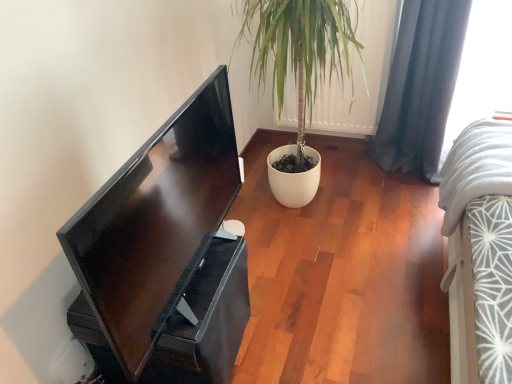
Describe the element at coordinates (482, 69) in the screenshot. The width and height of the screenshot is (512, 384). I see `white fabric at upper right` at that location.

The width and height of the screenshot is (512, 384). Find the location of `matte black monitor at left`. matte black monitor at left is located at coordinates (165, 253).

Is there a large distance between dark blue fabric curtain at right and white fabric at upper right?

They are positioned close to each other.

Considering the relative sizes of dark blue fabric curtain at right and white fabric at upper right in the image provided, is dark blue fabric curtain at right shorter than white fabric at upper right?

In fact, dark blue fabric curtain at right may be taller than white fabric at upper right.

Would you say dark blue fabric curtain at right is to the left or to the right of white fabric at upper right in the picture?

dark blue fabric curtain at right is positioned on white fabric at upper right's left side.

Is dark blue fabric curtain at right closer to the viewer compared to white fabric at upper right?

That is False.

Looking at the image, does white fabric at upper right seem bigger or smaller compared to matte black monitor at left?

Clearly, white fabric at upper right is larger in size than matte black monitor at left.

Is white fabric at upper right oriented towards matte black monitor at left?

No, white fabric at upper right is not turned towards matte black monitor at left.

Are white fabric at upper right and matte black monitor at left far apart?

Indeed, white fabric at upper right is not near matte black monitor at left.

From a real-world perspective, is matte black monitor at left positioned over dark blue fabric curtain at right based on gravity?

Correct, in the physical world, matte black monitor at left is higher than dark blue fabric curtain at right.

Which of these two, matte black monitor at left or dark blue fabric curtain at right, is smaller?

Smaller between the two is matte black monitor at left.

Is matte black monitor at left facing away from dark blue fabric curtain at right?

No, matte black monitor at left is not facing away from dark blue fabric curtain at right.

From the picture: From the image's perspective, between matte black monitor at left and dark blue fabric curtain at right, who is located below?

matte black monitor at left is shown below in the image.

Is dark blue fabric curtain at right shorter than matte black monitor at left?

No.

From the image's perspective, which one is positioned higher, dark blue fabric curtain at right or matte black monitor at left?

dark blue fabric curtain at right is shown above in the image.

Consider the image. Measure the distance between dark blue fabric curtain at right and matte black monitor at left.

A distance of 1.24 meters exists between dark blue fabric curtain at right and matte black monitor at left.

Which is more to the left, dark blue fabric curtain at right or matte black monitor at left?

matte black monitor at left is more to the left.

Does matte black monitor at left have a greater width compared to white fabric at upper right?

Incorrect, the width of matte black monitor at left does not surpass that of white fabric at upper right.

Considering the sizes of objects matte black monitor at left and white fabric at upper right in the image provided, who is shorter, matte black monitor at left or white fabric at upper right?

Standing shorter between the two is matte black monitor at left.

From the image's perspective, between matte black monitor at left and white fabric at upper right, which one is located above?

From the image's view, white fabric at upper right is above.

Based on the photo, is matte black monitor at left at the left side of white fabric at upper right?

Yes.

Considering the sizes of white fabric at upper right and dark blue fabric curtain at right in the image, is white fabric at upper right wider or thinner than dark blue fabric curtain at right?

Clearly, white fabric at upper right has more width compared to dark blue fabric curtain at right.

Between white fabric at upper right and dark blue fabric curtain at right, which one has less height?

With less height is white fabric at upper right.

Would you say white fabric at upper right contains dark blue fabric curtain at right?

No.

Between white fabric at upper right and dark blue fabric curtain at right, which one appears on the left side from the viewer's perspective?

Positioned to the left is dark blue fabric curtain at right.

At what (x,y) coordinates should I click in order to perform the action: click on curtain above the white fabric at upper right (from a real-world perspective). Please return your answer as a coordinate pair (x, y). The height and width of the screenshot is (384, 512). Looking at the image, I should click on (421, 85).

Find the location of a particular element. The image size is (512, 384). window above the matte black monitor at left (from the image's perspective) is located at coordinates (482, 69).

Considering their positions, is matte black monitor at left positioned closer to white fabric at upper right than dark blue fabric curtain at right?

dark blue fabric curtain at right is positioned closer to the anchor white fabric at upper right.

From the image, which object appears to be nearer to matte black monitor at left, white fabric at upper right or dark blue fabric curtain at right?

The object closer to matte black monitor at left is dark blue fabric curtain at right.

Considering their positions, is dark blue fabric curtain at right positioned further to matte black monitor at left than white fabric at upper right?

white fabric at upper right is further to matte black monitor at left.

When comparing their distances from dark blue fabric curtain at right, does white fabric at upper right or matte black monitor at left seem closer?

white fabric at upper right is closer to dark blue fabric curtain at right.

Based on their spatial positions, is dark blue fabric curtain at right or matte black monitor at left further from white fabric at upper right?

matte black monitor at left is positioned further to the anchor white fabric at upper right.

Which object lies nearer to the anchor point dark blue fabric curtain at right, matte black monitor at left or white fabric at upper right?

white fabric at upper right is closer to dark blue fabric curtain at right.

Locate an element on the screen. This screenshot has width=512, height=384. curtain between matte black monitor at left and white fabric at upper right from left to right is located at coordinates (421, 85).